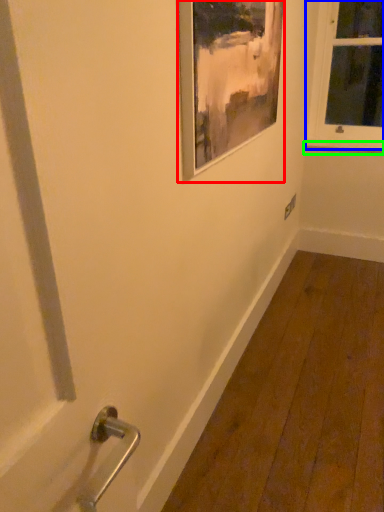
Question: Which object is positioned farthest from picture frame (highlighted by a red box)? Select from window (highlighted by a blue box) and window sill (highlighted by a green box).

Choices:
 (A) window
 (B) window sill

Answer: (B)